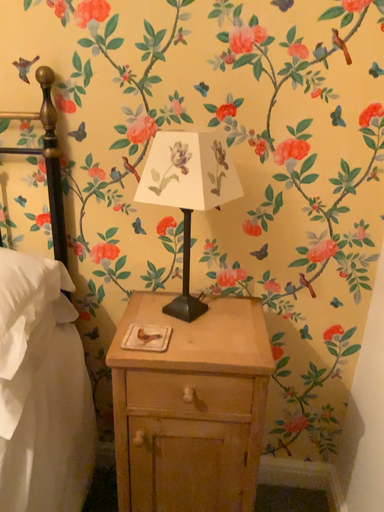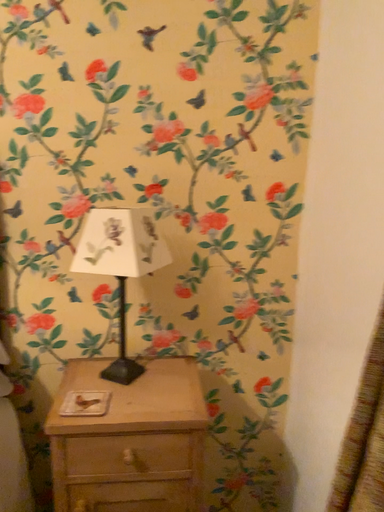
Question: How did the camera likely rotate when shooting the video?

Choices:
 (A) rotated upward
 (B) rotated downward

Answer: (A)